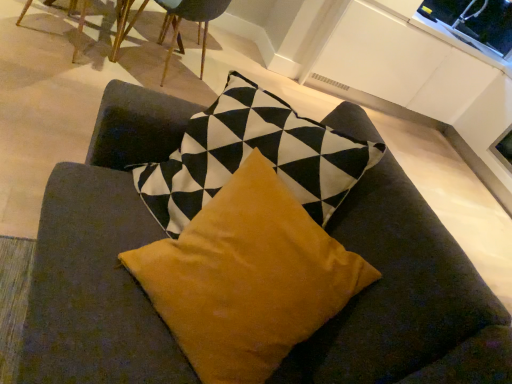
Question: Considering the relative sizes of transparent glass window screen at upper right and wooden chair at upper left, the second chair positioned from the right, in the image provided, is transparent glass window screen at upper right wider than wooden chair at upper left, the second chair positioned from the right,?

Choices:
 (A) yes
 (B) no

Answer: (B)

Question: Does transparent glass window screen at upper right appear on the left side of wooden chair at upper left, the second chair positioned from the right?

Choices:
 (A) yes
 (B) no

Answer: (B)

Question: Does transparent glass window screen at upper right have a larger size compared to wooden chair at upper left, the second chair positioned from the right?

Choices:
 (A) no
 (B) yes

Answer: (A)

Question: Is wooden chair at upper left, positioned as the 1th chair in left-to-right order, located within transparent glass window screen at upper right?

Choices:
 (A) yes
 (B) no

Answer: (B)

Question: Is transparent glass window screen at upper right next to wooden chair at upper left, the second chair positioned from the right?

Choices:
 (A) yes
 (B) no

Answer: (B)

Question: Would you say wooden chair at upper center, the 1th chair in the right-to-left sequence, is to the left or to the right of mustard velvet pillow at center in the picture?

Choices:
 (A) right
 (B) left

Answer: (B)

Question: Considering the positions of wooden chair at upper center, marked as the 2th chair in a left-to-right arrangement, and mustard velvet pillow at center in the image, is wooden chair at upper center, marked as the 2th chair in a left-to-right arrangement, bigger or smaller than mustard velvet pillow at center?

Choices:
 (A) big
 (B) small

Answer: (A)

Question: From the image's perspective, is wooden chair at upper center, the 1th chair in the right-to-left sequence, above or below mustard velvet pillow at center?

Choices:
 (A) above
 (B) below

Answer: (A)

Question: Considering their positions, is wooden chair at upper center, the 1th chair in the right-to-left sequence, located in front of or behind mustard velvet pillow at center?

Choices:
 (A) behind
 (B) front

Answer: (A)

Question: Considering the positions of transparent glass window screen at upper right and wooden chair at upper center, the 1th chair in the right-to-left sequence, in the image, is transparent glass window screen at upper right wider or thinner than wooden chair at upper center, the 1th chair in the right-to-left sequence,?

Choices:
 (A) wide
 (B) thin

Answer: (B)

Question: In terms of size, does transparent glass window screen at upper right appear bigger or smaller than wooden chair at upper center, marked as the 2th chair in a left-to-right arrangement?

Choices:
 (A) big
 (B) small

Answer: (B)

Question: Which is correct: transparent glass window screen at upper right is inside wooden chair at upper center, the 1th chair in the right-to-left sequence, or outside of it?

Choices:
 (A) inside
 (B) outside

Answer: (B)

Question: From the image's perspective, is transparent glass window screen at upper right located above or below wooden chair at upper center, the 1th chair in the right-to-left sequence?

Choices:
 (A) above
 (B) below

Answer: (B)

Question: Considering their positions, is transparent glass window screen at upper right located in front of or behind wooden chair at upper left, the second chair positioned from the right?

Choices:
 (A) behind
 (B) front

Answer: (A)

Question: Based on their sizes in the image, would you say transparent glass window screen at upper right is bigger or smaller than wooden chair at upper left, positioned as the 1th chair in left-to-right order?

Choices:
 (A) big
 (B) small

Answer: (B)